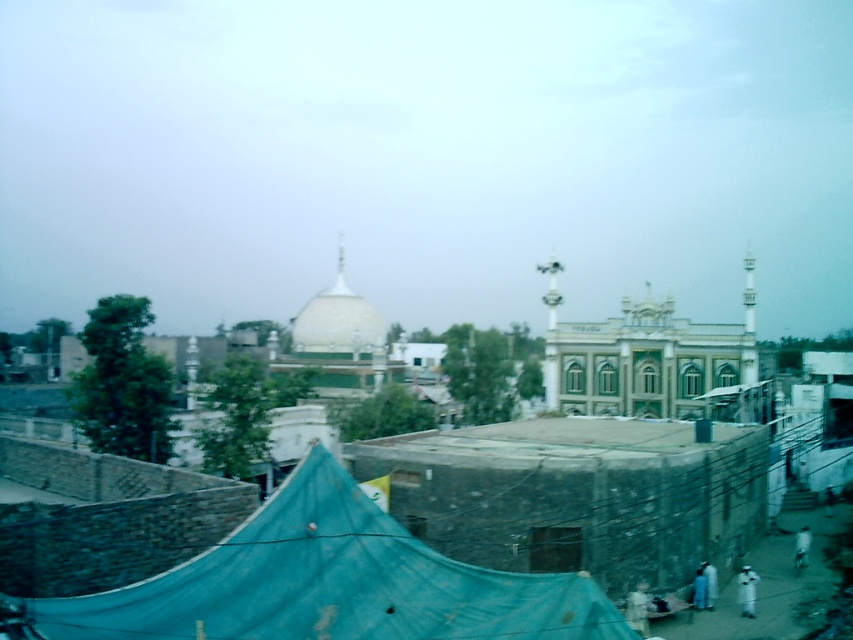
Question: Can you confirm if blue tarpaulin at center is positioned above white glossy dome at center?

Choices:
 (A) yes
 (B) no

Answer: (B)

Question: Can you confirm if blue tarpaulin at center is bigger than white glossy dome at center?

Choices:
 (A) no
 (B) yes

Answer: (B)

Question: Which point is closer to the camera?

Choices:
 (A) blue tarpaulin at center
 (B) white glossy dome at center

Answer: (A)

Question: Which object is farther from the camera taking this photo?

Choices:
 (A) blue tarpaulin at center
 (B) white glossy dome at center

Answer: (B)

Question: Is blue tarpaulin at center further to the viewer compared to white glossy dome at center?

Choices:
 (A) yes
 (B) no

Answer: (B)

Question: Which of the following is the farthest from the observer?

Choices:
 (A) (252, 593)
 (B) (312, 316)

Answer: (B)